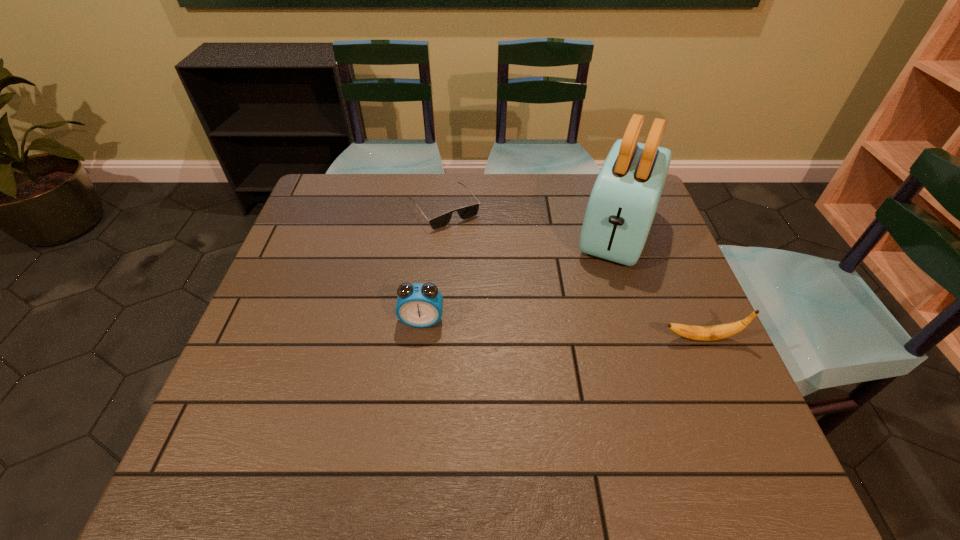
The image size is (960, 540). In order to click on object positioned at the far right corner in this screenshot , I will do `click(624, 199)`.

Locate an element on the screen. This screenshot has height=540, width=960. free spot at the far edge of the desktop is located at coordinates (500, 186).

Identify the location of vacant space at the near edge of the desktop. (359, 396).

The height and width of the screenshot is (540, 960). In the image, there is a desktop. What are the coordinates of `vacant area at the left edge` in the screenshot? It's located at (270, 367).

The width and height of the screenshot is (960, 540). In the image, there is a desktop. Identify the location of free space at the right edge. (671, 303).

Where is `vacant space at the far left corner of the desktop`? This screenshot has height=540, width=960. vacant space at the far left corner of the desktop is located at coordinates (320, 215).

Locate an element on the screen. free space at the near left corner of the desktop is located at coordinates (290, 393).

Where is `vacant region between the tallest object and the third tallest object`? vacant region between the tallest object and the third tallest object is located at coordinates (660, 285).

You are a GUI agent. You are given a task and a screenshot of the screen. Output one action in this format:
    pyautogui.click(x=<x>, y=<y>)
    Task: Click on the free space between the third shortest object and the toaster
    
    Given the screenshot: What is the action you would take?
    point(519,276)

Find the location of a particular element. vacant region between the banana and the sunglasses is located at coordinates (573, 274).